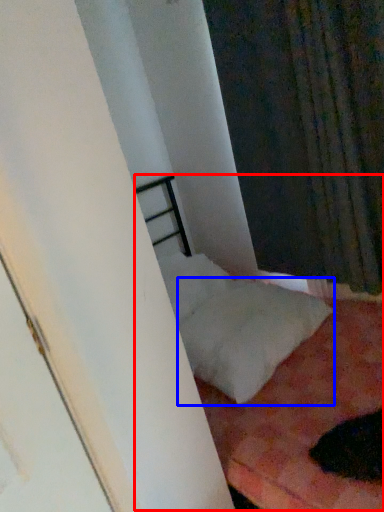
Question: Among these objects, which one is farthest to the camera, bed (highlighted by a red box) or pillow (highlighted by a blue box)?

Choices:
 (A) bed
 (B) pillow

Answer: (B)